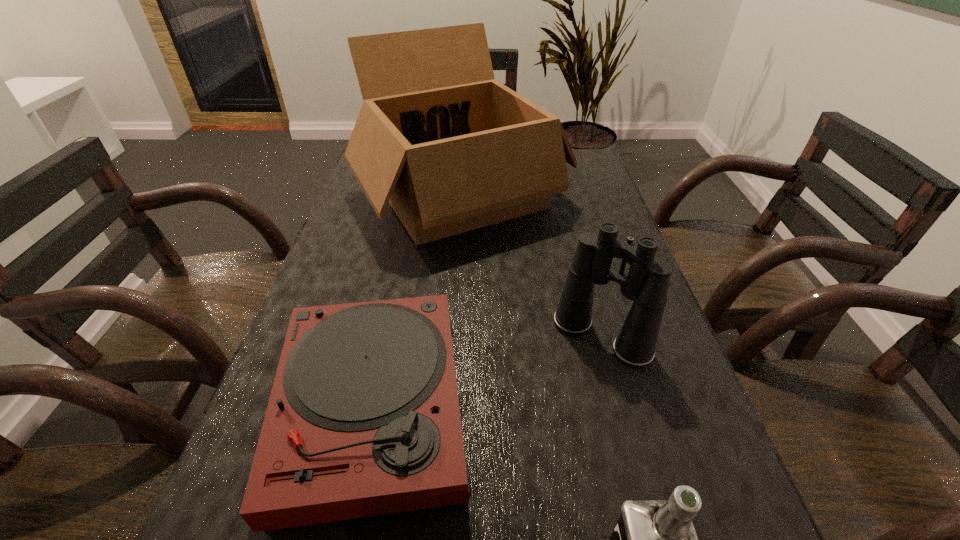
Find the location of a particular element. The width and height of the screenshot is (960, 540). the farthest object is located at coordinates (451, 149).

You are a GUI agent. You are given a task and a screenshot of the screen. Output one action in this format:
    pyautogui.click(x=<x>, y=<y>)
    Task: Click on the box
    
    Given the screenshot: What is the action you would take?
    pyautogui.click(x=451, y=149)

At what (x,y) coordinates should I click in order to perform the action: click on binoculars. Please return your answer as a coordinate pair (x, y). Image resolution: width=960 pixels, height=540 pixels. Looking at the image, I should click on (647, 283).

What are the coordinates of `record player` in the screenshot? It's located at (363, 419).

Locate an element on the screen. free point located 0.250m on the front of the box is located at coordinates (450, 344).

The height and width of the screenshot is (540, 960). Find the location of `free region located 0.370m on the left of the binoculars`. free region located 0.370m on the left of the binoculars is located at coordinates (366, 337).

Locate an element on the screen. This screenshot has height=540, width=960. blank area located on the right of the record player is located at coordinates (615, 407).

The height and width of the screenshot is (540, 960). In order to click on object at the far edge in this screenshot , I will do `click(451, 149)`.

What are the coordinates of `box present at the left edge` in the screenshot? It's located at (451, 149).

Find the location of a particular element. The height and width of the screenshot is (540, 960). record player that is at the left edge is located at coordinates (363, 419).